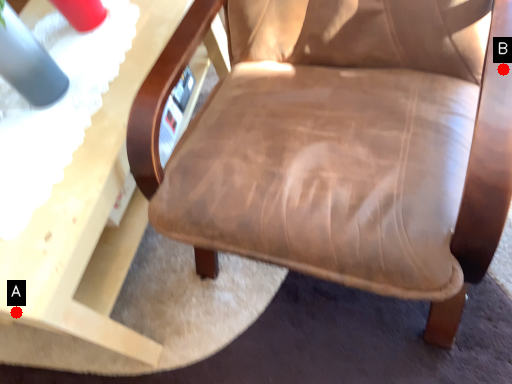
Question: Two points are circled on the image, labeled by A and B beside each circle. Which point is further to the camera?

Choices:
 (A) A is further
 (B) B is further

Answer: (A)